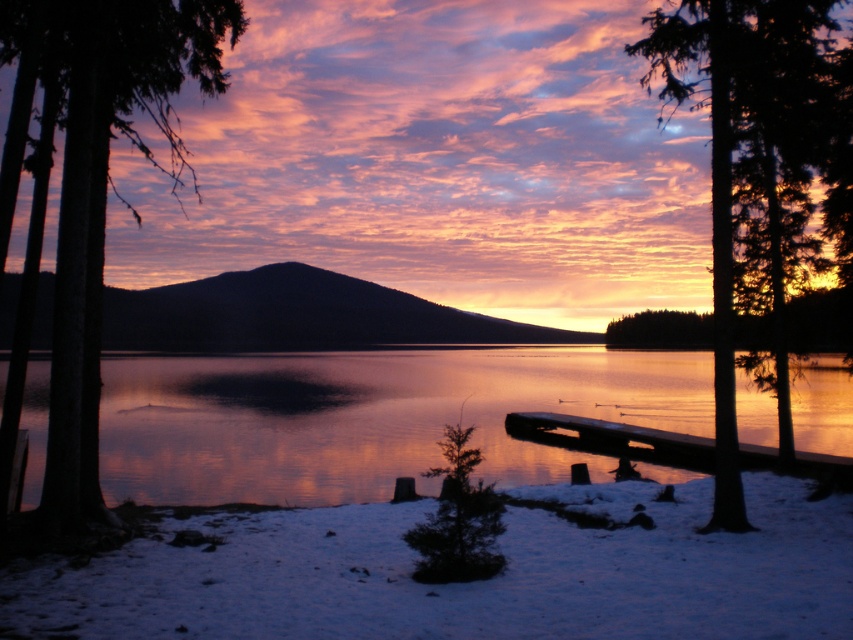
Question: Which object is farther from the camera taking this photo?

Choices:
 (A) glistening water at center
 (B) wooden dock at lower right
 (C) smooth bark tree at left
 (D) green matte tree at upper right

Answer: (B)

Question: Does glistening water at center lie in front of wooden dock at lower right?

Choices:
 (A) yes
 (B) no

Answer: (A)

Question: Does smooth bark tree at left lie in front of wooden dock at lower right?

Choices:
 (A) yes
 (B) no

Answer: (A)

Question: Does glistening water at center appear over wooden dock at lower right?

Choices:
 (A) yes
 (B) no

Answer: (A)

Question: Which of these objects is positioned closest to the smooth bark tree at left?

Choices:
 (A) green matte tree at upper right
 (B) wooden dock at lower right

Answer: (A)

Question: Which point appears closest to the camera in this image?

Choices:
 (A) (624, 372)
 (B) (82, 307)

Answer: (B)